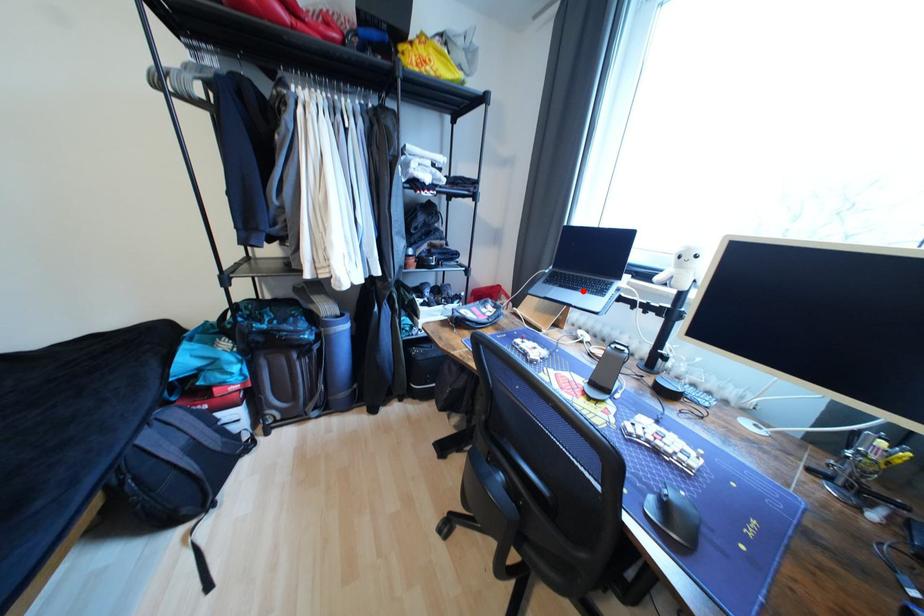
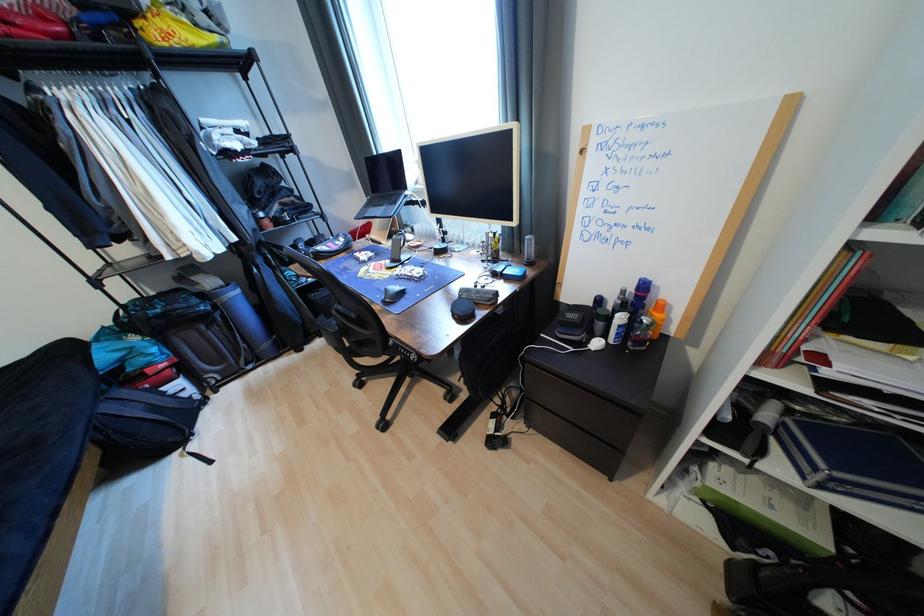
Locate, in the second image, the point that corresponds to the highlighted location in the first image.

(388, 207)